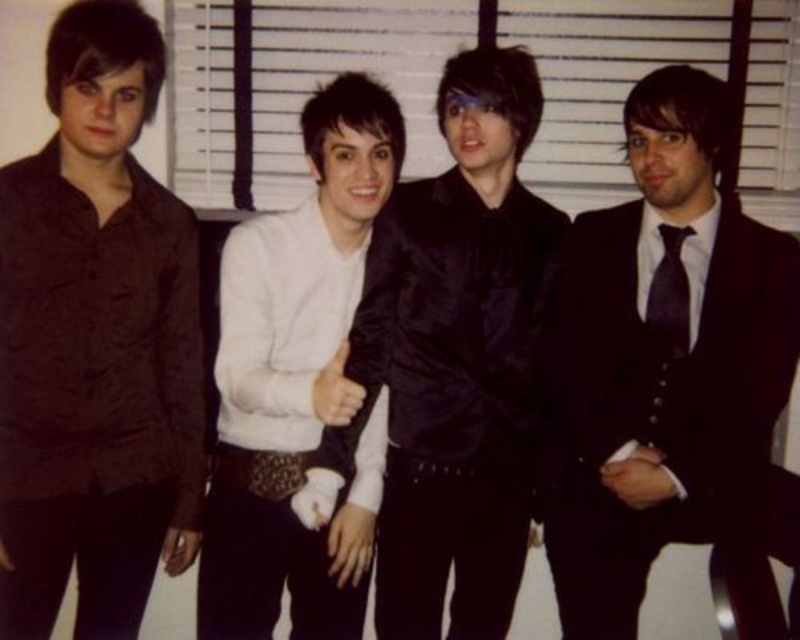
Question: Among these objects, which one is nearest to the camera?

Choices:
 (A) satin black suit at center
 (B) black satin tie at right

Answer: (A)

Question: Which of the following is the closest to the observer?

Choices:
 (A) white matte shirt at center
 (B) black satin tie at right

Answer: (A)

Question: Which object appears farthest from the camera in this image?

Choices:
 (A) satin black suit at center
 (B) white matte shirt at center

Answer: (A)

Question: Does shiny black suit at right have a greater width compared to white matte shirt at center?

Choices:
 (A) no
 (B) yes

Answer: (B)

Question: Can you confirm if shiny black suit at right is bigger than white matte shirt at center?

Choices:
 (A) yes
 (B) no

Answer: (B)

Question: Observing the image, what is the correct spatial positioning of white matte shirt at center in reference to black satin tie at right?

Choices:
 (A) below
 (B) above

Answer: (A)